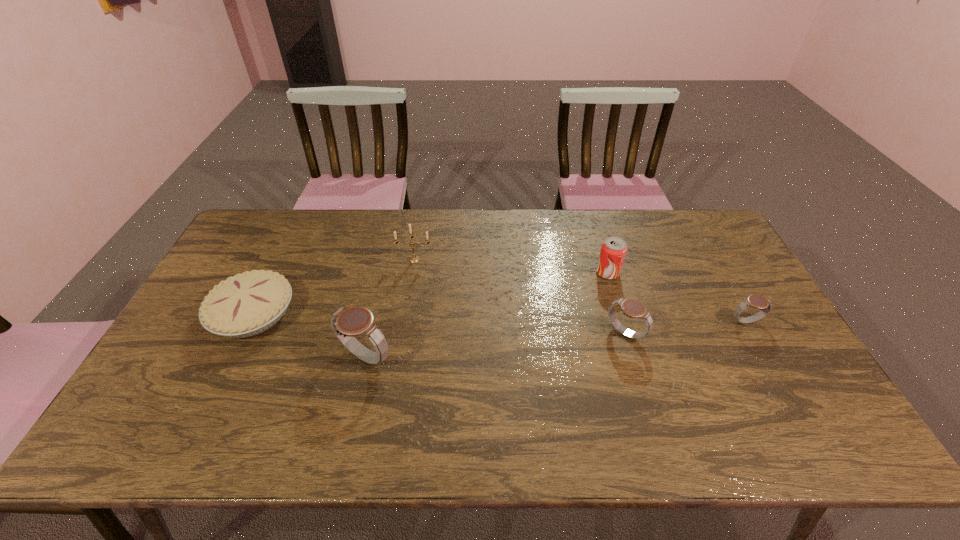
Identify which object is located as the fifth nearest to the soda can. Please provide its 2D coordinates. Your answer should be formatted as a tuple, i.e. [(x, y)], where the tuple contains the x and y coordinates of a point satisfying the conditions above.

[(247, 304)]

Where is `watch that can be found as the closest to the rightmost object`? This screenshot has width=960, height=540. watch that can be found as the closest to the rightmost object is located at coordinates (632, 308).

Select which watch appears as the closest to the farthest object. Please provide its 2D coordinates. Your answer should be formatted as a tuple, i.e. [(x, y)], where the tuple contains the x and y coordinates of a point satisfying the conditions above.

[(347, 323)]

Image resolution: width=960 pixels, height=540 pixels. I want to click on free space that satisfies the following two spatial constraints: 1. on the front side of the leftmost watch; 2. on the right side of the pie, so click(231, 357).